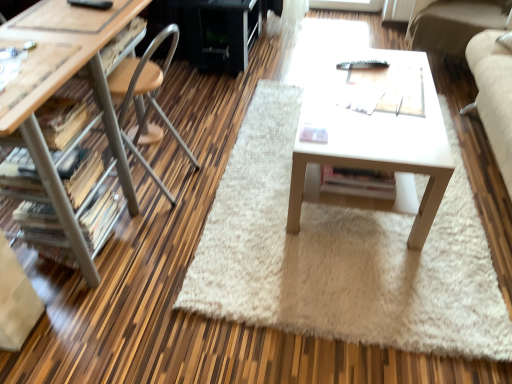
Question: Is white shaggy rug at center positioned beyond the bounds of wooden drawer at left?

Choices:
 (A) no
 (B) yes

Answer: (B)

Question: Does white shaggy rug at center have a smaller size compared to wooden drawer at left?

Choices:
 (A) no
 (B) yes

Answer: (A)

Question: Considering the relative sizes of white shaggy rug at center and wooden drawer at left in the image provided, is white shaggy rug at center shorter than wooden drawer at left?

Choices:
 (A) yes
 (B) no

Answer: (A)

Question: Considering the relative sizes of white shaggy rug at center and wooden drawer at left in the image provided, is white shaggy rug at center wider than wooden drawer at left?

Choices:
 (A) no
 (B) yes

Answer: (B)

Question: Is white shaggy rug at center closer to the viewer compared to wooden drawer at left?

Choices:
 (A) no
 (B) yes

Answer: (B)

Question: Is white shaggy rug at center to the left of wooden drawer at left from the viewer's perspective?

Choices:
 (A) yes
 (B) no

Answer: (B)

Question: From the image's perspective, is black glossy entertainment center at upper center below matte wood desk at left?

Choices:
 (A) yes
 (B) no

Answer: (B)

Question: Considering the relative sizes of black glossy entertainment center at upper center and matte wood desk at left in the image provided, is black glossy entertainment center at upper center shorter than matte wood desk at left?

Choices:
 (A) no
 (B) yes

Answer: (B)

Question: Does black glossy entertainment center at upper center have a greater width compared to matte wood desk at left?

Choices:
 (A) no
 (B) yes

Answer: (B)

Question: From the image's perspective, is black glossy entertainment center at upper center on top of matte wood desk at left?

Choices:
 (A) yes
 (B) no

Answer: (A)

Question: Is black glossy entertainment center at upper center positioned before matte wood desk at left?

Choices:
 (A) yes
 (B) no

Answer: (B)

Question: Is black glossy entertainment center at upper center smaller than matte wood desk at left?

Choices:
 (A) yes
 (B) no

Answer: (A)

Question: Does wooden drawer at left have a larger size compared to white shaggy rug at center?

Choices:
 (A) yes
 (B) no

Answer: (B)